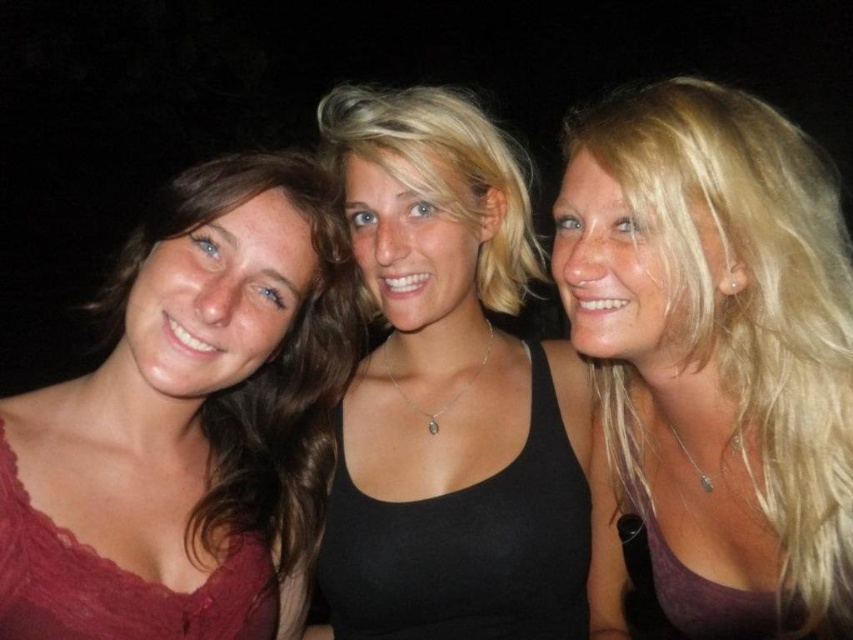
You are a photographer trying to adjust the lighting for a night photo shoot. You have two subjects wearing the black matte tank top at center and the matte red dress at left. Since the background is dark, you want to ensure both subjects are well lit. Which subject should you focus the light on first to ensure their clothing colors are visible?

The black matte tank top at center is located above the matte red dress at left, so focusing the light on the black matte tank top at center first will ensure its darker color stands out against the dark background, while also illuminating the lower positioned matte red dress at left.

You are a photographer trying to adjust the focus on your camera to capture the blonde hair at center and the matte red dress at left. Which object should you focus on first if you want to ensure both are in focus?

The blonde hair at center is further to the viewer than the matte red dress at left. To ensure both are in focus, you should focus on the matte red dress at left first, as it is closer to the camera. This will create a depth of field that includes both the closer and farther objects.

You are a photographer trying to adjust the lighting for a group photo. You notice the blonde hair at center and the matte red dress at left. Which object should you focus on first if you want to ensure proper exposure, considering their sizes?

The blonde hair at center should be focused on first because it has a larger size compared to the matte red dress at left, making it more prominent in the frame.